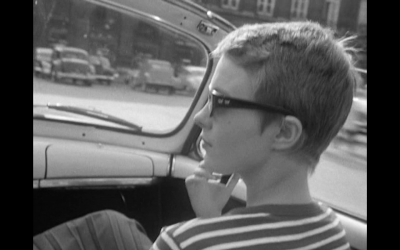
Locate an element on the screen. The image size is (400, 250). windows is located at coordinates (337, 13), (305, 10), (265, 9), (233, 8).